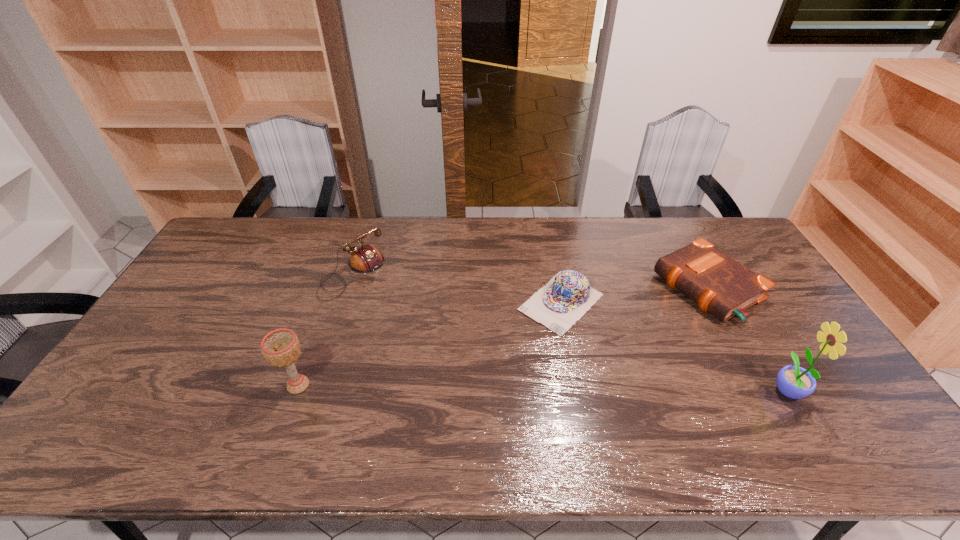
Identify the location of object identified as the fourth closest to the third object from left to right. The width and height of the screenshot is (960, 540). (281, 347).

Image resolution: width=960 pixels, height=540 pixels. Identify the location of vacant space that satisfies the following two spatial constraints: 1. on the front side of the tallest object; 2. on the front-facing side of the third object from left to right. (578, 389).